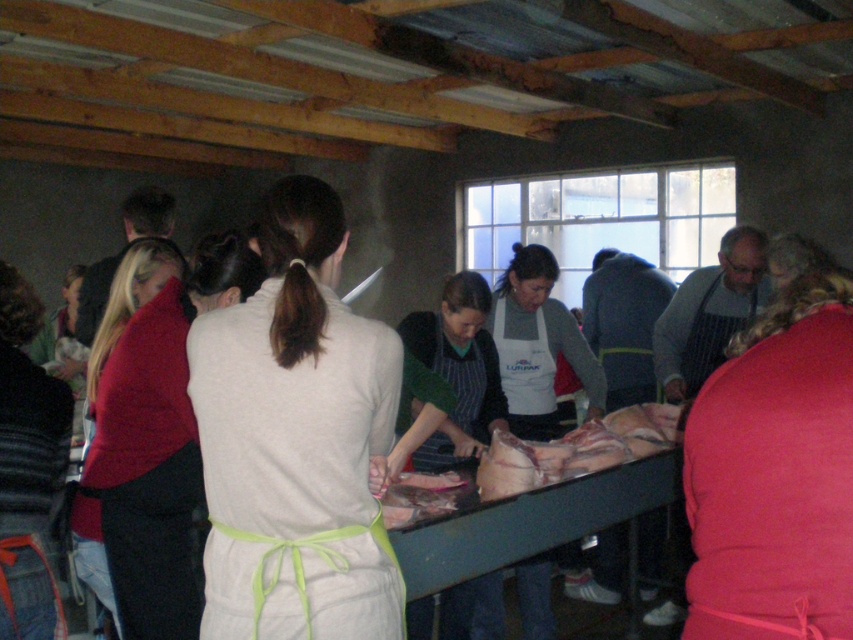
Does pinkish raw meat at center have a lesser width compared to pink raw meat at center?

No.

Where is `pinkish raw meat at center`? pinkish raw meat at center is located at coordinates (577, 449).

Where is `pink fabric at center`? pink fabric at center is located at coordinates (776, 465).

Can you confirm if pink fabric at center is taller than pink raw meat at center?

Indeed, pink fabric at center has a greater height compared to pink raw meat at center.

The image size is (853, 640). I want to click on pink fabric at center, so click(776, 465).

What do you see at coordinates (138, 436) in the screenshot?
I see `matte red sweater at center` at bounding box center [138, 436].

Does point (111, 401) come in front of point (540, 531)?

Yes.

Who is more forward, (94, 566) or (645, 477)?

Point (94, 566) is more forward.

At what (x,y) coordinates should I click in order to perform the action: click on matte red sweater at center. Please return your answer as a coordinate pair (x, y). The height and width of the screenshot is (640, 853). Looking at the image, I should click on (138, 436).